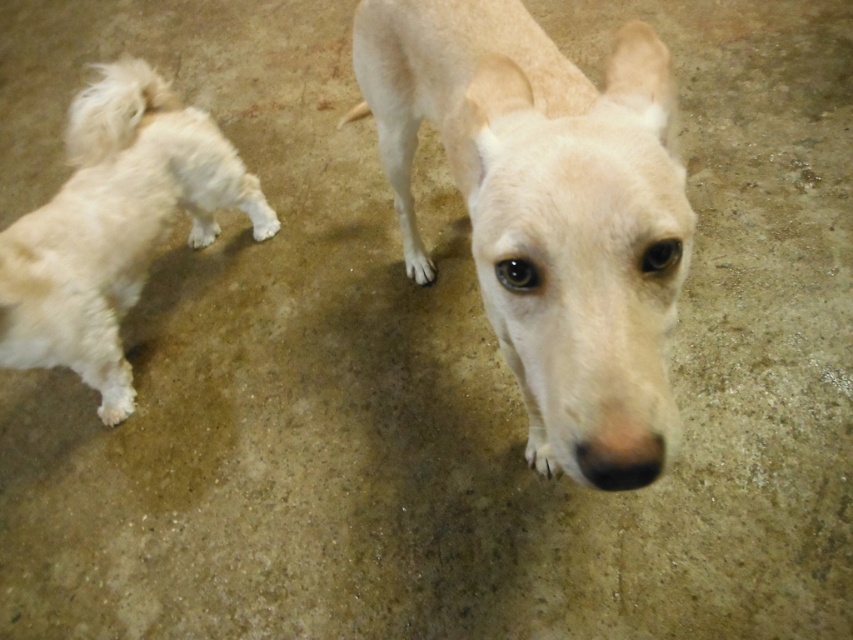
Question: Which of the following is the closest to the observer?

Choices:
 (A) (561, 84)
 (B) (120, 198)

Answer: (A)

Question: Can you confirm if light beige fur dog at center is positioned above white fluffy dog at left?

Choices:
 (A) no
 (B) yes

Answer: (A)

Question: Considering the relative positions of light beige fur dog at center and white fluffy dog at left in the image provided, where is light beige fur dog at center located with respect to white fluffy dog at left?

Choices:
 (A) above
 (B) below

Answer: (B)

Question: Can you confirm if light beige fur dog at center is bigger than white fluffy dog at left?

Choices:
 (A) no
 (B) yes

Answer: (B)